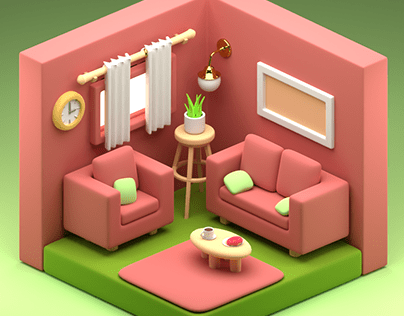
You are a GUI agent. You are given a task and a screenshot of the screen. Output one action in this format:
    pyautogui.click(x=<x>, y=<y>)
    Task: Click on the rug
    
    Given the screenshot: What is the action you would take?
    coord(210,276)